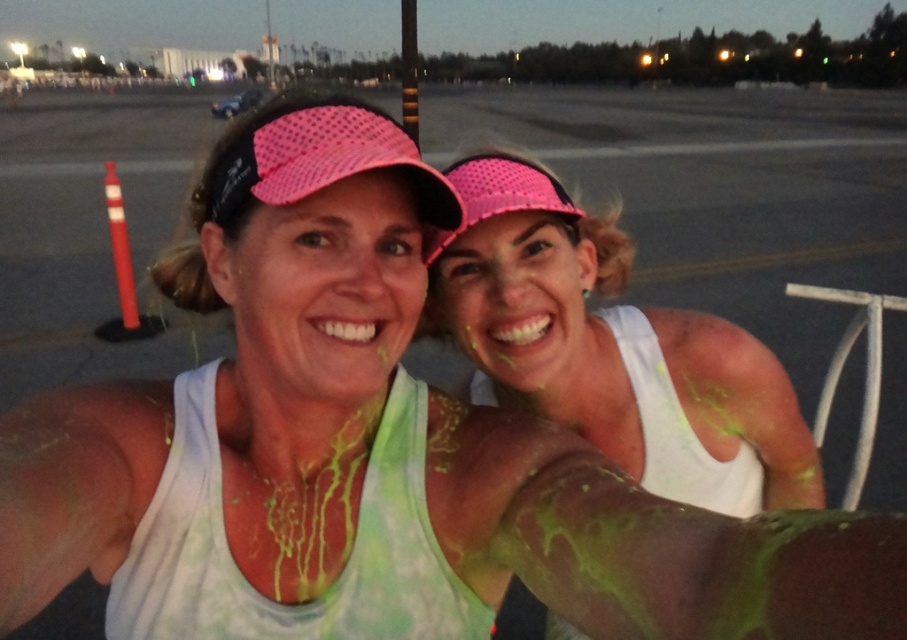
You are a photographer trying to capture a clear shot of the matte pink cap at center and the pink mesh visor at upper center. Which object is closer to the camera?

The pink mesh visor at upper center is closer to the camera because the matte pink cap at center is behind it.

What is the 2D coordinate of the pink mesh visor at upper center in the image?

The pink mesh visor at upper center is located at the 2D coordinate point of (610, 348).

Based on the photo, you are a photographer trying to capture the scene from the ground level. Which of the two caps, the matte pink cap at center or the pink mesh cap at upper center, would appear closer to your camera lens?

The matte pink cap at center would appear closer to the camera lens because it is positioned above the pink mesh cap at upper center, meaning it is nearer to the viewer.